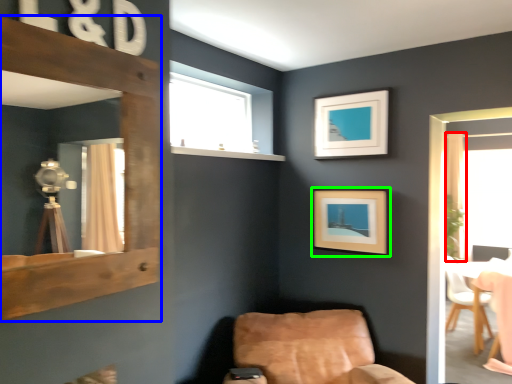
Question: Which object is positioned farthest from curtain (highlighted by a red box)? Select from mirror (highlighted by a blue box) and picture frame (highlighted by a green box).

Choices:
 (A) mirror
 (B) picture frame

Answer: (A)